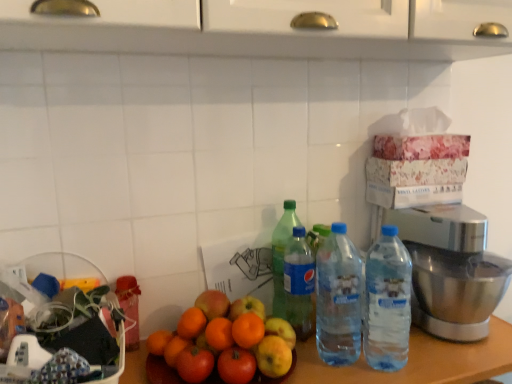
Question: Is green plastic bottle at center, arranged as the 4th bottle when viewed from the right, positioned beyond the bounds of polished stainless steel mixer at right?

Choices:
 (A) yes
 (B) no

Answer: (A)

Question: Is green plastic bottle at center, arranged as the first bottle when viewed from the left, at the left side of polished stainless steel mixer at right?

Choices:
 (A) no
 (B) yes

Answer: (B)

Question: Is the position of green plastic bottle at center, arranged as the first bottle when viewed from the left, more distant than that of polished stainless steel mixer at right?

Choices:
 (A) no
 (B) yes

Answer: (B)

Question: Is green plastic bottle at center, arranged as the 4th bottle when viewed from the right, to the right of polished stainless steel mixer at right from the viewer's perspective?

Choices:
 (A) no
 (B) yes

Answer: (A)

Question: From the image's perspective, does green plastic bottle at center, arranged as the first bottle when viewed from the left, appear lower than polished stainless steel mixer at right?

Choices:
 (A) yes
 (B) no

Answer: (B)

Question: From a real-world perspective, is wooden table at center physically located above or below translucent plastic bottle at center, arranged as the third bottle when viewed from the right?

Choices:
 (A) above
 (B) below

Answer: (B)

Question: Would you say wooden table at center is to the left or to the right of translucent plastic bottle at center, arranged as the third bottle when viewed from the right, in the picture?

Choices:
 (A) right
 (B) left

Answer: (A)

Question: Is wooden table at center in front of or behind translucent plastic bottle at center, placed as the 2th bottle when sorted from left to right, in the image?

Choices:
 (A) behind
 (B) front

Answer: (B)

Question: Considering the positions of point (452, 374) and point (305, 301), is point (452, 374) closer or farther from the camera than point (305, 301)?

Choices:
 (A) farther
 (B) closer

Answer: (B)

Question: Considering the positions of point (409, 243) and point (310, 379), is point (409, 243) closer or farther from the camera than point (310, 379)?

Choices:
 (A) farther
 (B) closer

Answer: (A)

Question: Considering their positions, is polished stainless steel mixer at right located in front of or behind wooden table at center?

Choices:
 (A) behind
 (B) front

Answer: (A)

Question: From a real-world perspective, relative to wooden table at center, is polished stainless steel mixer at right vertically above or below?

Choices:
 (A) below
 (B) above

Answer: (B)

Question: From the image's perspective, is polished stainless steel mixer at right positioned above or below wooden table at center?

Choices:
 (A) above
 (B) below

Answer: (A)

Question: Does point (302, 274) appear closer or farther from the camera than point (297, 221)?

Choices:
 (A) closer
 (B) farther

Answer: (A)

Question: From a real-world perspective, is translucent plastic bottle at center, arranged as the third bottle when viewed from the right, positioned above or below green plastic bottle at center, arranged as the first bottle when viewed from the left?

Choices:
 (A) above
 (B) below

Answer: (B)